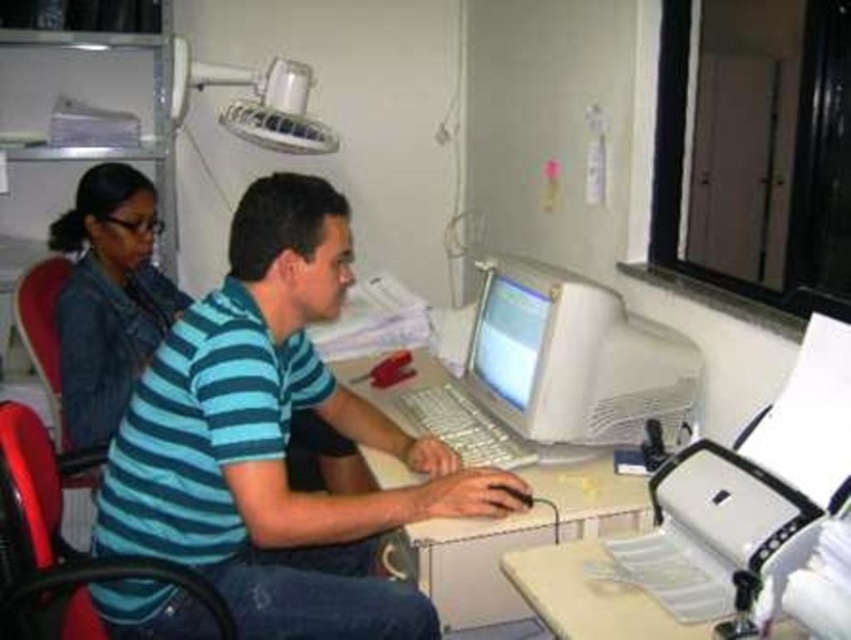
Describe the element at coordinates (277, 442) in the screenshot. I see `blue striped shirt at center` at that location.

Is point (283, 253) closer to viewer compared to point (180, 301)?

That is True.

Where is `blue striped shirt at center`? The image size is (851, 640). blue striped shirt at center is located at coordinates (277, 442).

I want to click on blue striped shirt at center, so click(277, 442).

Is denim jacket at left above red plastic swivel chair at left?

Yes.

Does denim jacket at left have a lesser height compared to red plastic swivel chair at left?

In fact, denim jacket at left may be taller than red plastic swivel chair at left.

Between point (72, 237) and point (10, 468), which one is positioned behind?

Positioned behind is point (72, 237).

At what (x,y) coordinates should I click in order to perform the action: click on denim jacket at left. Please return your answer as a coordinate pair (x, y). Looking at the image, I should click on (107, 298).

Between denim jacket at left and matte plastic monitor at center, which one is positioned higher?

denim jacket at left

Between denim jacket at left and matte plastic monitor at center, which one appears on the left side from the viewer's perspective?

denim jacket at left is more to the left.

What do you see at coordinates (107, 298) in the screenshot? I see `denim jacket at left` at bounding box center [107, 298].

Image resolution: width=851 pixels, height=640 pixels. I want to click on denim jacket at left, so click(x=107, y=298).